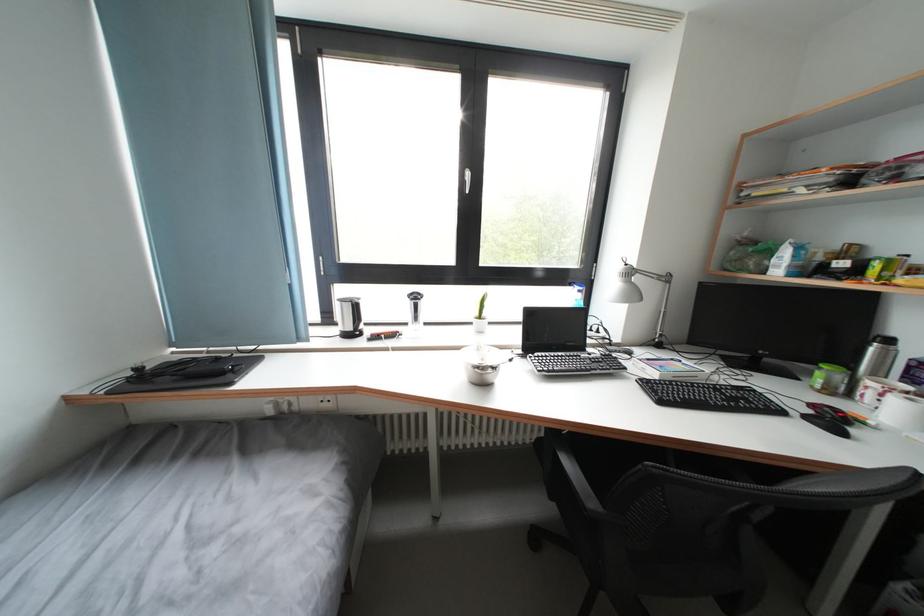
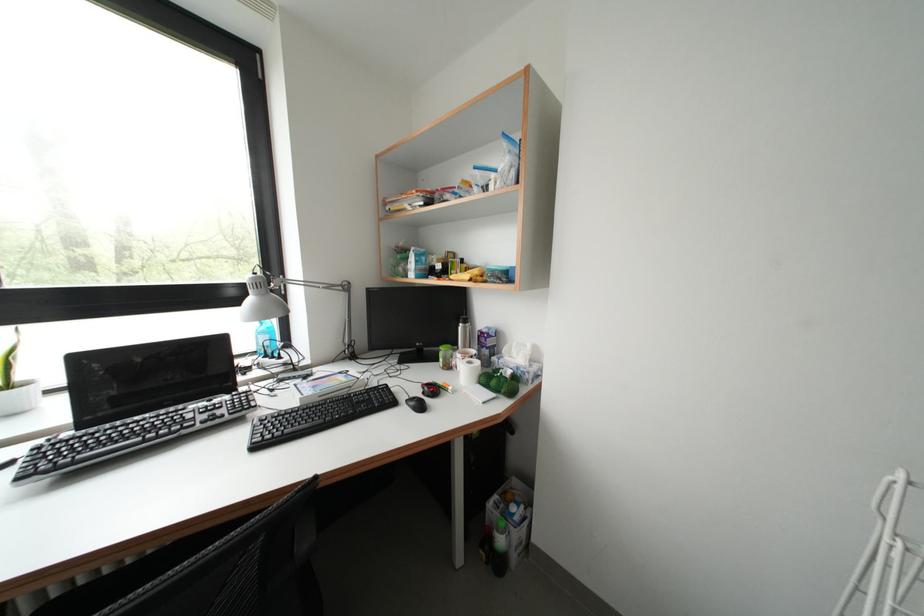
Question: The camera is either moving clockwise (left) or counter-clockwise (right) around the object. The first image is from the beginning of the video and the second image is from the end. Is the camera moving left or right when shooting the video?

Choices:
 (A) Left
 (B) Right

Answer: (A)